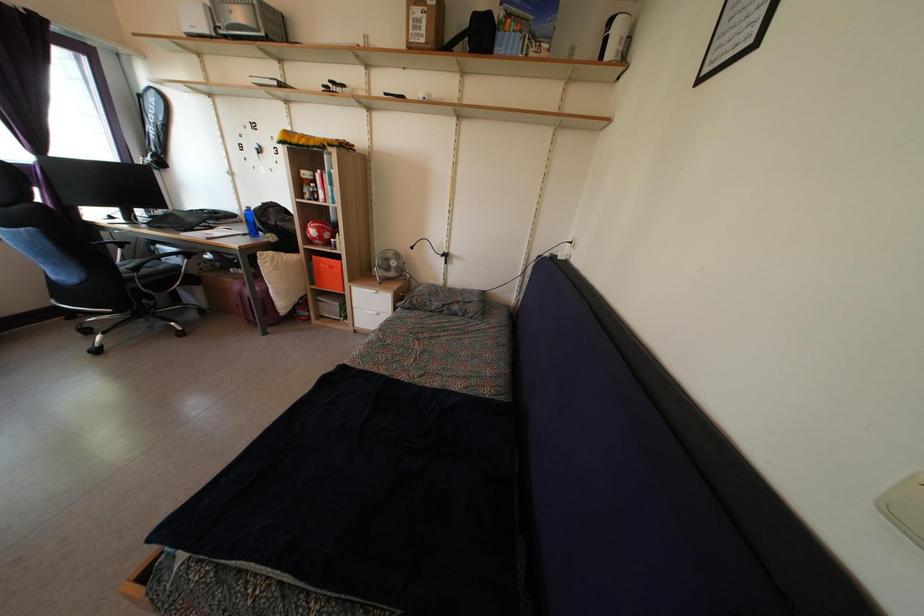
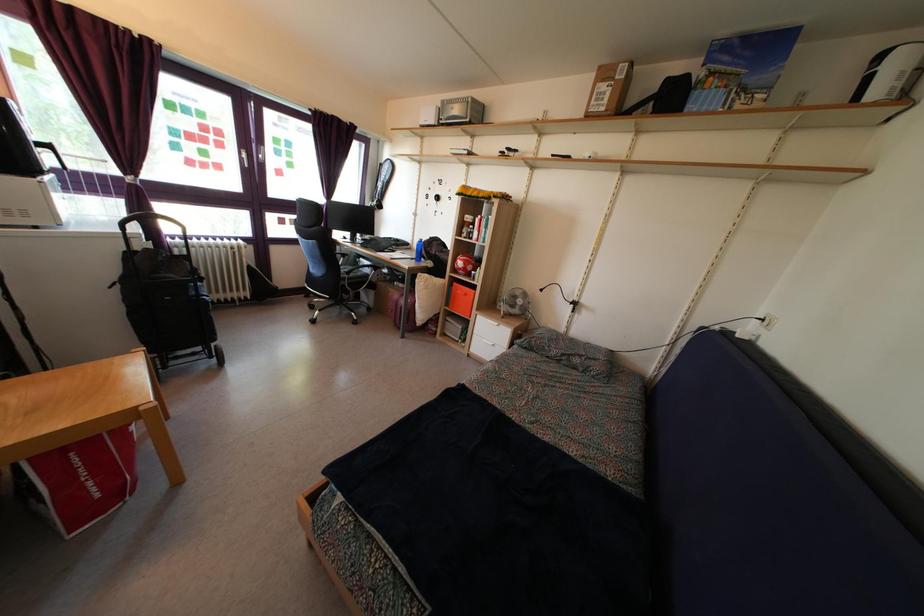
In the second image, find the point that corresponds to point 315,241 in the first image.

(463, 272)